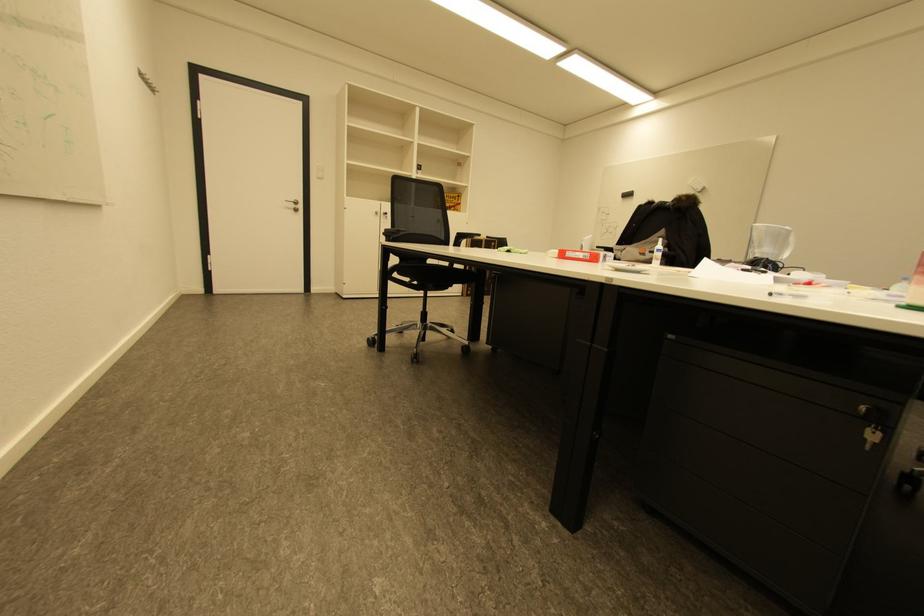
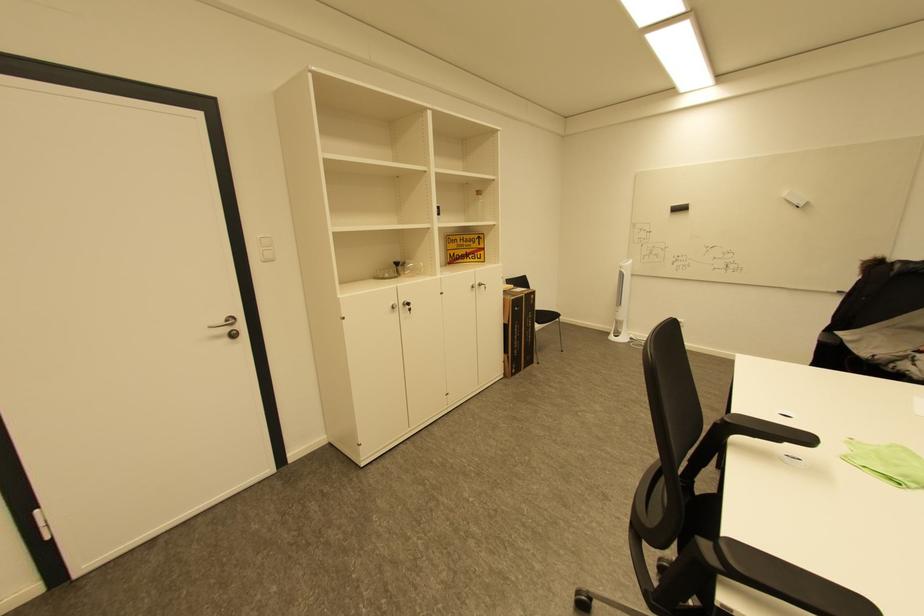
Find the pixel in the second image that matches (633,196) in the first image.

(686, 209)